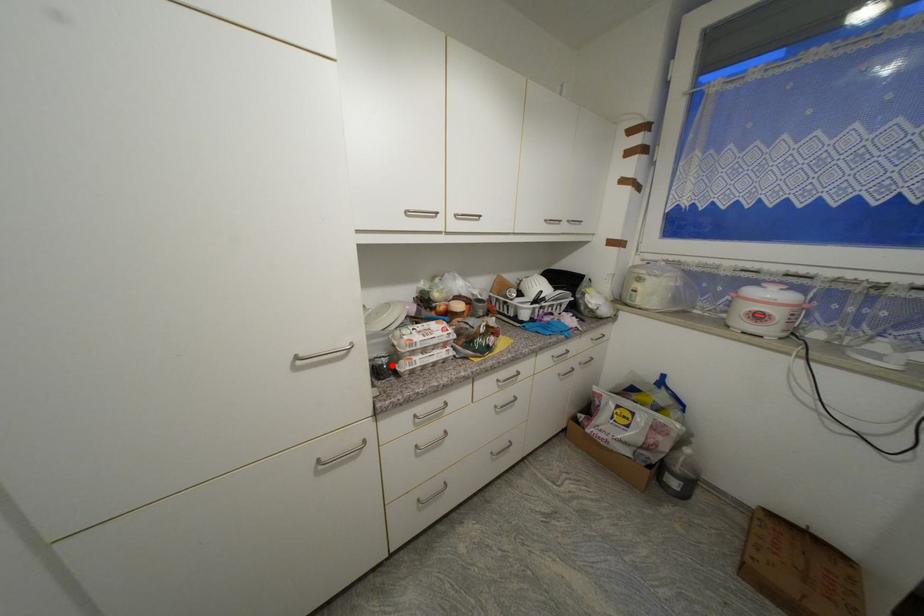
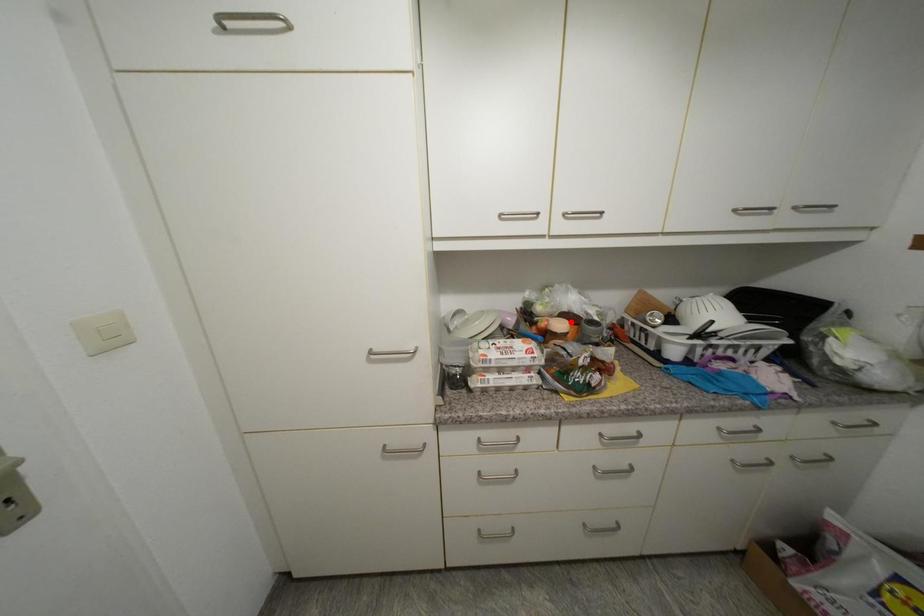
I am providing you with two images of the same scene from different viewpoints. A red point is marked on the first image and another point is marked on the second image. Does the point marked in image1 correspond to the same location as the one in image2?

No